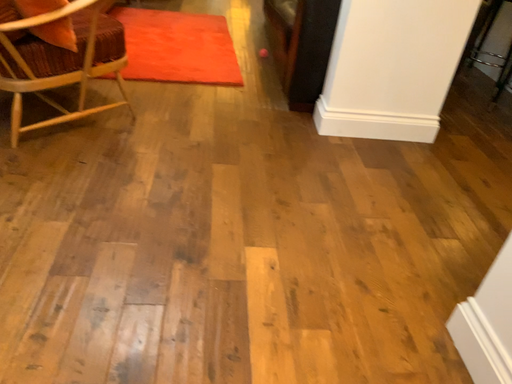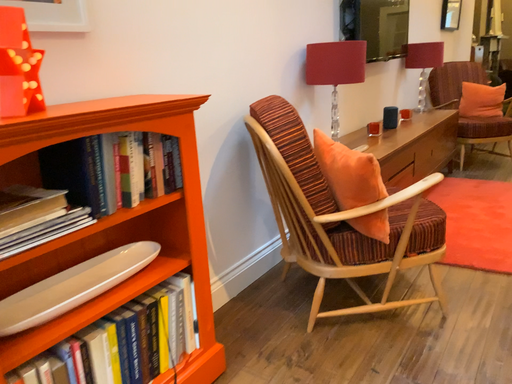
Question: Which way did the camera rotate in the video?

Choices:
 (A) rotated downward
 (B) rotated upward

Answer: (B)